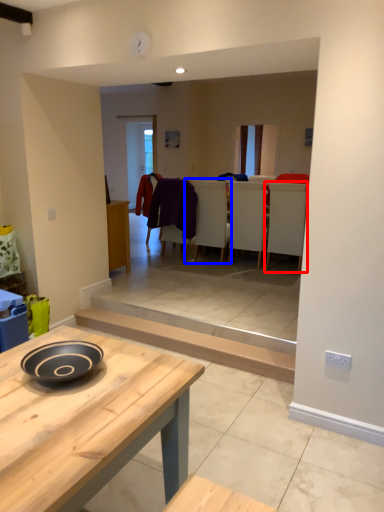
Question: Which object appears farthest to the camera in this image, armchair (highlighted by a red box) or armchair (highlighted by a blue box)?

Choices:
 (A) armchair
 (B) armchair

Answer: (B)